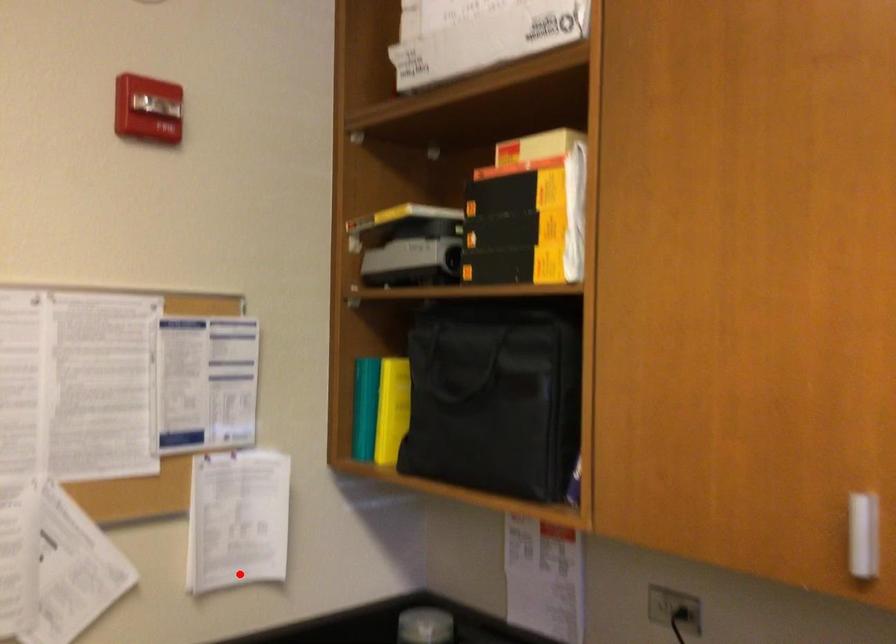
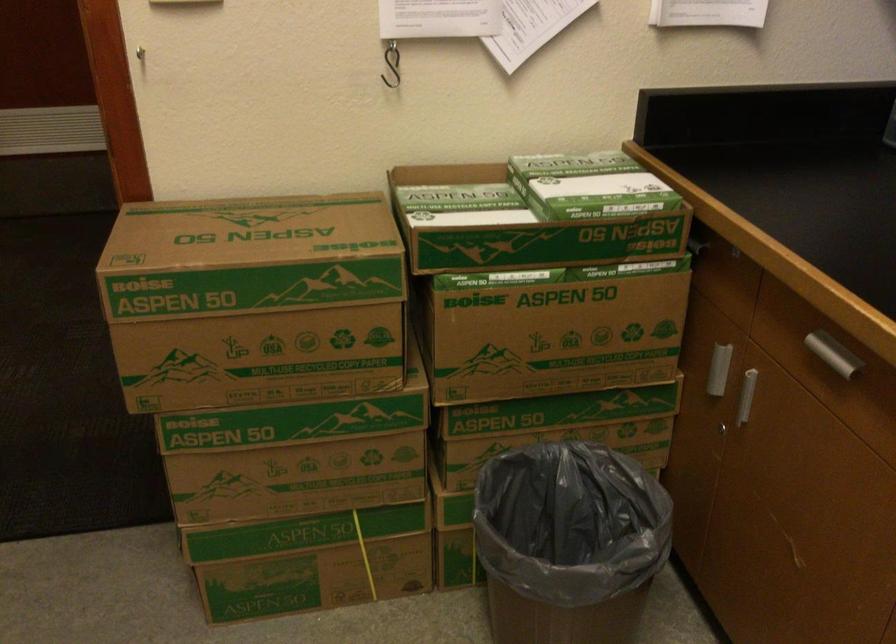
Where in the second image is the point corresponding to the highlighted location from the first image?

(708, 13)